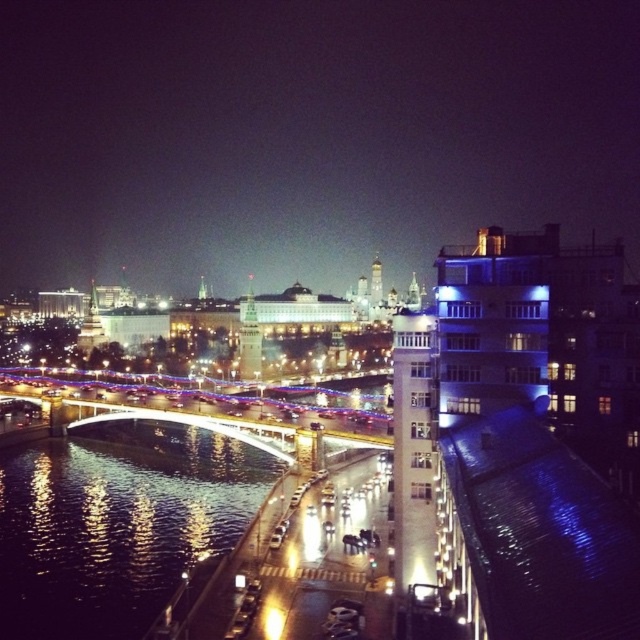
You are standing at the camera position looking at the cityscape. There is a point labeled as point (252, 301) in the image. If you want to throw a small pebble to hit that point, would you need to throw it forward or backward from your current position?

You need to throw the pebble forward because the point (252, 301) is 190.39 meters away from the camera, meaning it is located in front of your current position.

You are a photographer planning to capture the entire scene in one shot. Given that the glossy reflective water at lower left and the white glass tower at right are both important elements, which object should you prioritize framing closer to the center of your photo to ensure it doesn

The white glass tower at right should be prioritized closer to the center of the photo because it is larger in size compared to the glossy reflective water at lower left, as stated in the description.

You are a drone operator trying to capture a photo of the reflective glass bridge at center and the glossy reflective water at lower left. Can you fit both objects into the frame if your camera has a maximum field of view of 250 meters?

The distance between the reflective glass bridge at center and the glossy reflective water at lower left is 268.92 meters, which exceeds the camera field of view of 250 meters. Therefore, both objects cannot be captured in a single frame.